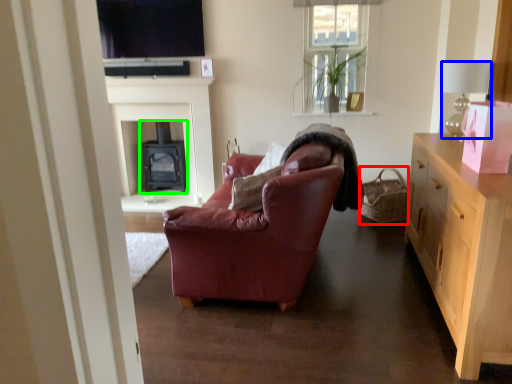
Question: Which is nearer to the picnic basket (highlighted by a red box)? lamp (highlighted by a blue box) or fireplace (highlighted by a green box).

Choices:
 (A) lamp
 (B) fireplace

Answer: (A)